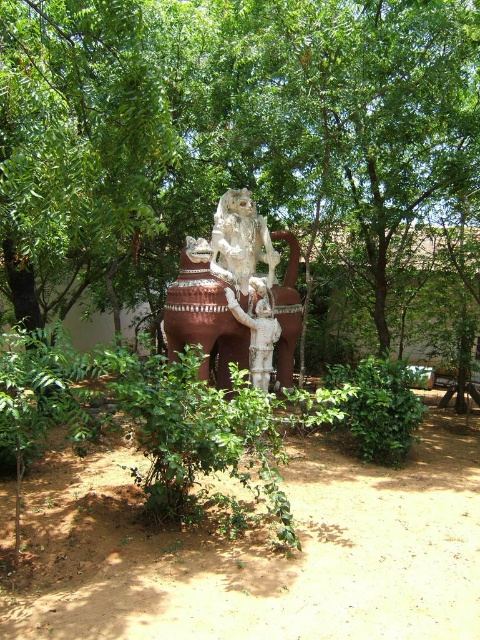
You are a gardener planning to water the green leafy tree at center and the white glossy statue at center. The watering hose you have can only reach 8 feet. Can you water both without moving the hose? Please explain your reasoning.

The green leafy tree at center and the white glossy statue at center are 8.20 feet apart. Since the hose can only reach 8 feet, the distance between them exceeds the hose length by 0.20 feet. Therefore, you cannot water both without moving the hose.

You are standing in front of the statue and want to determine the relative positions of two points on it. The first point is located at coordinates point (372,106) and the second at point (236,321). Which point is closer to you?

Point (372,106) is further to the viewer than point (236,321). Therefore, the point closer to you is point (236,321).

You are standing in front of the statue and want to take a photo of the white glossy statue at center with the green leafy tree at center in the background. Which side should you position yourself to ensure the tree is behind the statue?

You should position yourself to the left of the white glossy statue at center because the green leafy tree at center is located to the right of the statue, so standing on the left side will place the tree behind the statue.